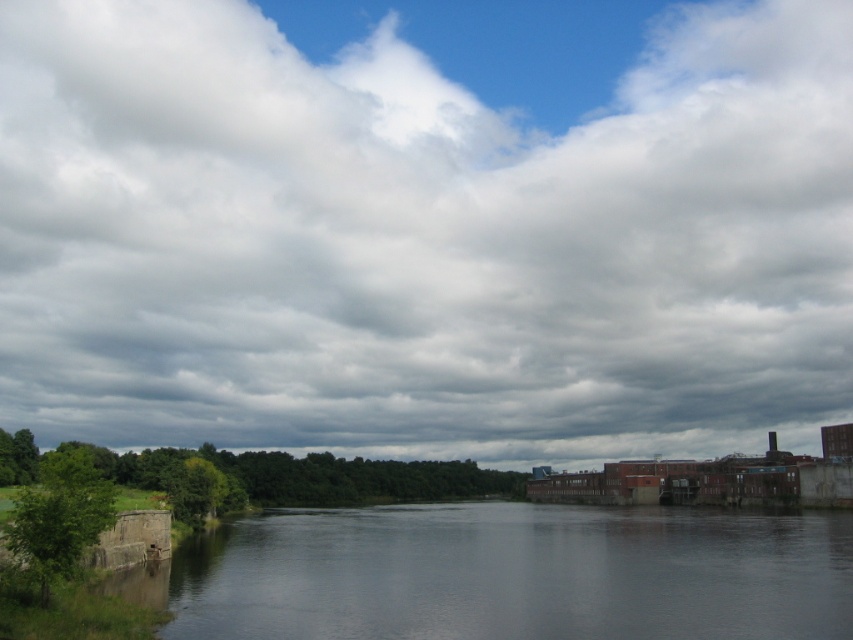
Which is behind, point (480, 161) or point (439, 572)?

The point (480, 161) is behind.

Between point (462, 412) and point (689, 593), which one is positioned in front?

Point (689, 593)

Where is `cloudy sky at upper center`? This screenshot has height=640, width=853. cloudy sky at upper center is located at coordinates (421, 241).